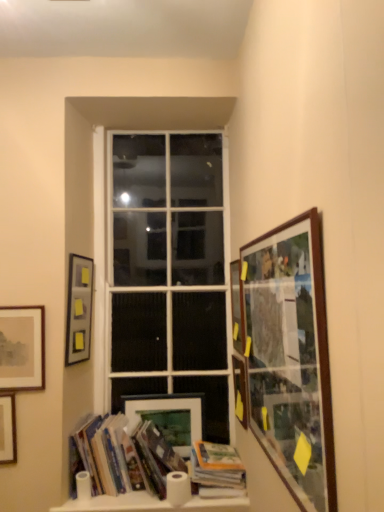
Locate an element on the screen. This screenshot has width=384, height=512. blank space to the left of white matte toilet paper at lower center, which ranks as the 1th toilet paper in right-to-left order is located at coordinates (148, 494).